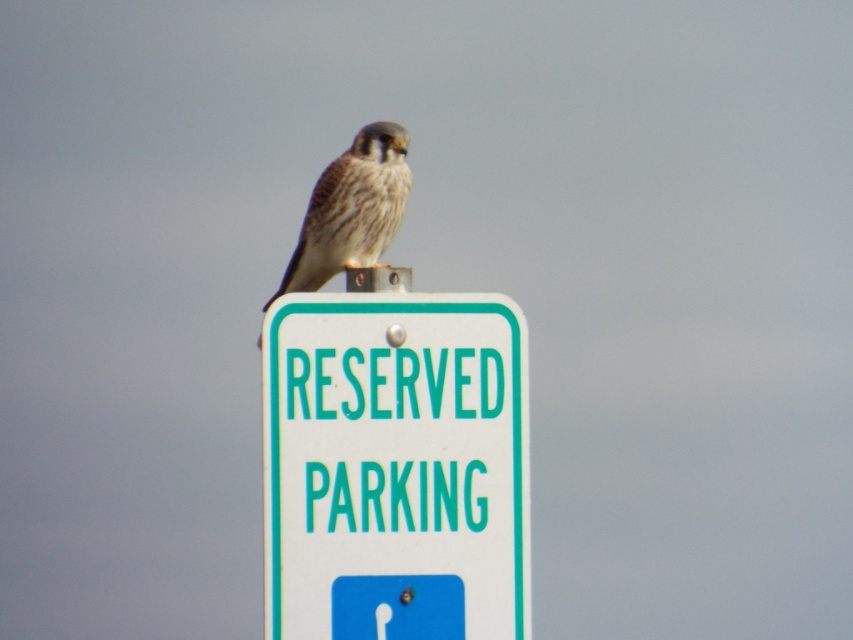
Is white plastic sign at center closer to the viewer compared to speckled feathered falcon at center?

Yes, it is in front of speckled feathered falcon at center.

The image size is (853, 640). Identify the location of white plastic sign at center. (395, 454).

You are a GUI agent. You are given a task and a screenshot of the screen. Output one action in this format:
    pyautogui.click(x=<x>, y=<y>)
    Task: Click on the white plastic sign at center
    
    Given the screenshot: What is the action you would take?
    click(x=395, y=454)